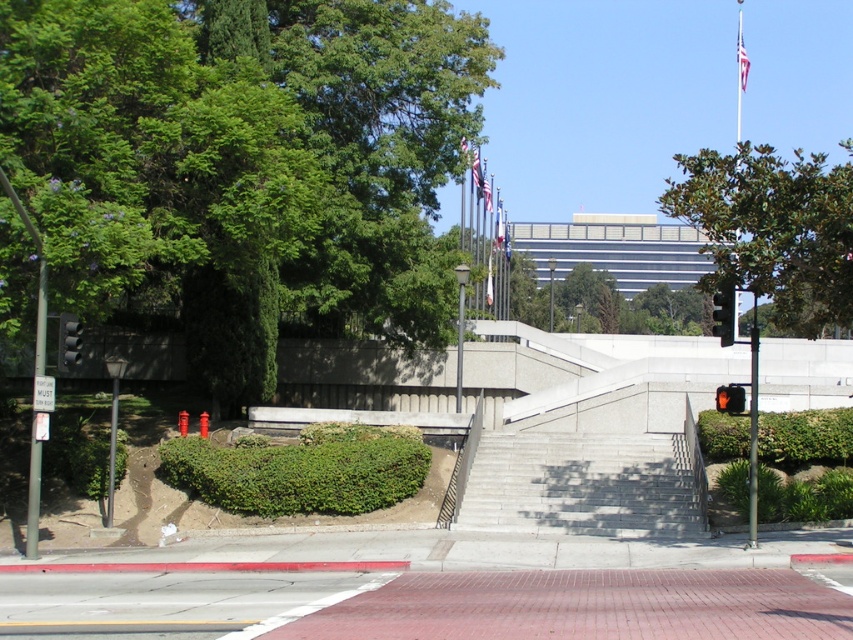
Question: Is black plastic traffic light at right to the right of white fabric flag at center from the viewer's perspective?

Choices:
 (A) yes
 (B) no

Answer: (A)

Question: Among these points, which one is nearest to the camera?

Choices:
 (A) pos(762,464)
 (B) pos(738,70)
 (C) pos(688,205)

Answer: (C)

Question: Can you confirm if gray concrete stairs at center is positioned to the right of orange plastic traffic light at center?

Choices:
 (A) yes
 (B) no

Answer: (B)

Question: Which point is closer to the camera taking this photo?

Choices:
 (A) tap(364, 83)
 (B) tap(711, 243)
 (C) tap(747, 502)

Answer: (C)

Question: Which of the following is the closest to the observer?

Choices:
 (A) black plastic traffic light at right
 (B) blue fabric flag at center

Answer: (A)

Question: Is black plastic traffic light at right to the left of orange plastic traffic light at center from the viewer's perspective?

Choices:
 (A) no
 (B) yes

Answer: (A)